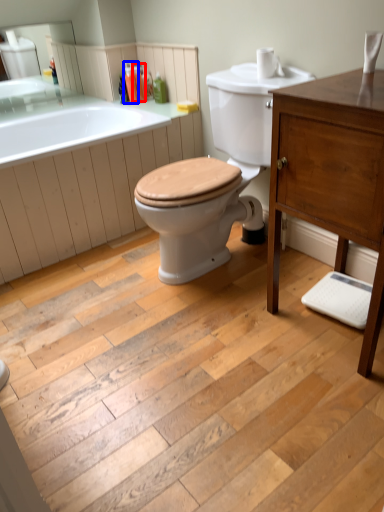
Question: Among these objects, which one is nearest to the camera, toiletry (highlighted by a red box) or toiletry (highlighted by a blue box)?

Choices:
 (A) toiletry
 (B) toiletry

Answer: (B)